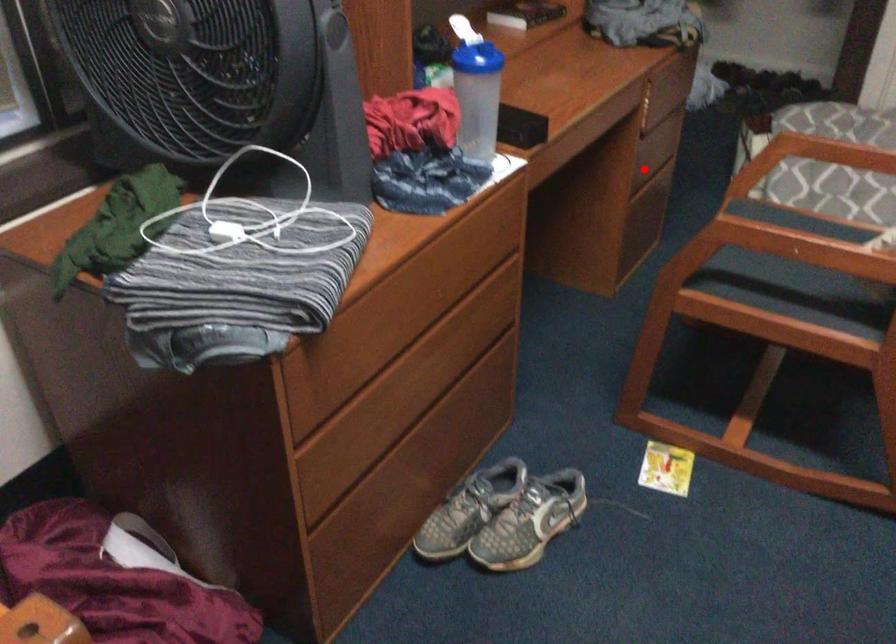
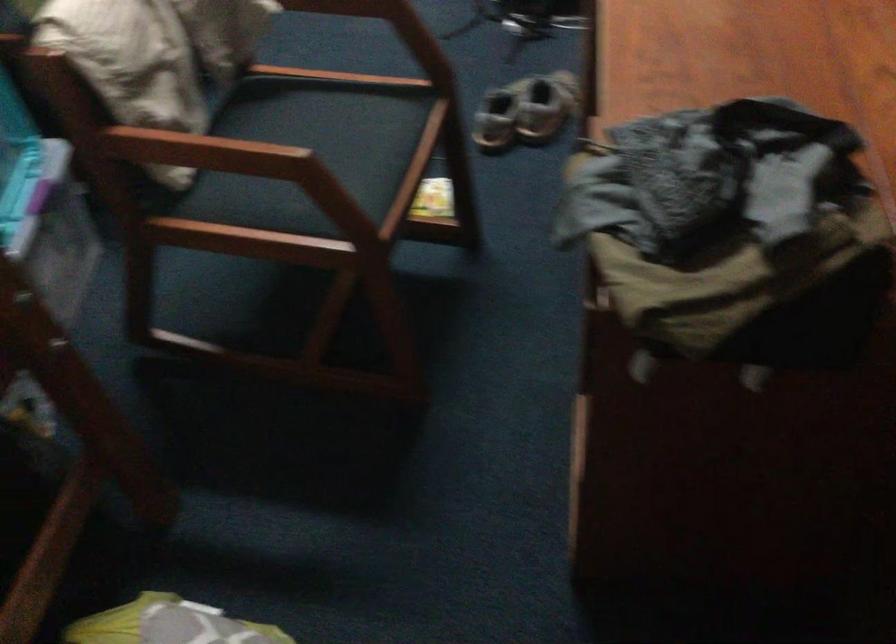
Question: I am providing you with two images of the same scene from different viewpoints. A red point is marked on the first image. At the location where the point appears in image 1, is it still visible in image 2?

Choices:
 (A) Yes
 (B) No

Answer: (B)